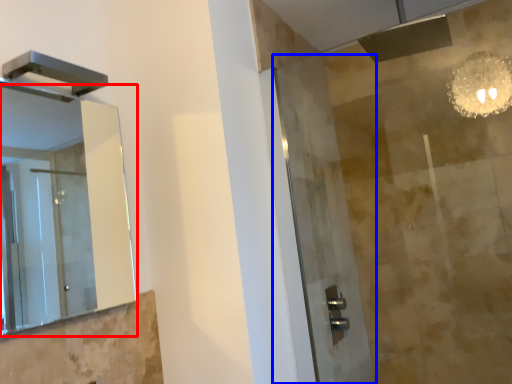
Question: Which point is closer to the camera, mirror (highlighted by a red box) or screen door (highlighted by a blue box)?

Choices:
 (A) mirror
 (B) screen door

Answer: (A)